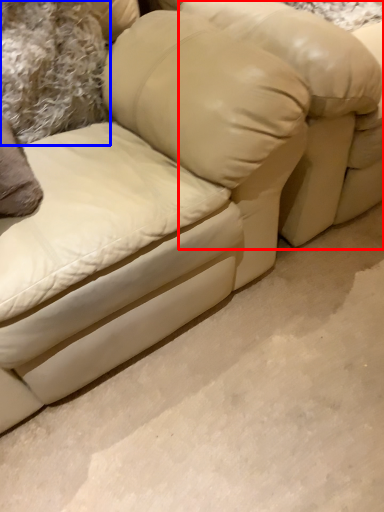
Question: Which object appears closest to the camera in this image, bean bag chair (highlighted by a red box) or pillow (highlighted by a blue box)?

Choices:
 (A) bean bag chair
 (B) pillow

Answer: (A)